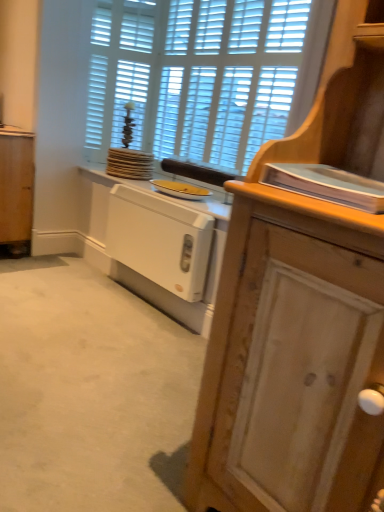
This screenshot has width=384, height=512. Identify the location of free spot below white plastic radiator at center (from a real-world perspective). click(141, 304).